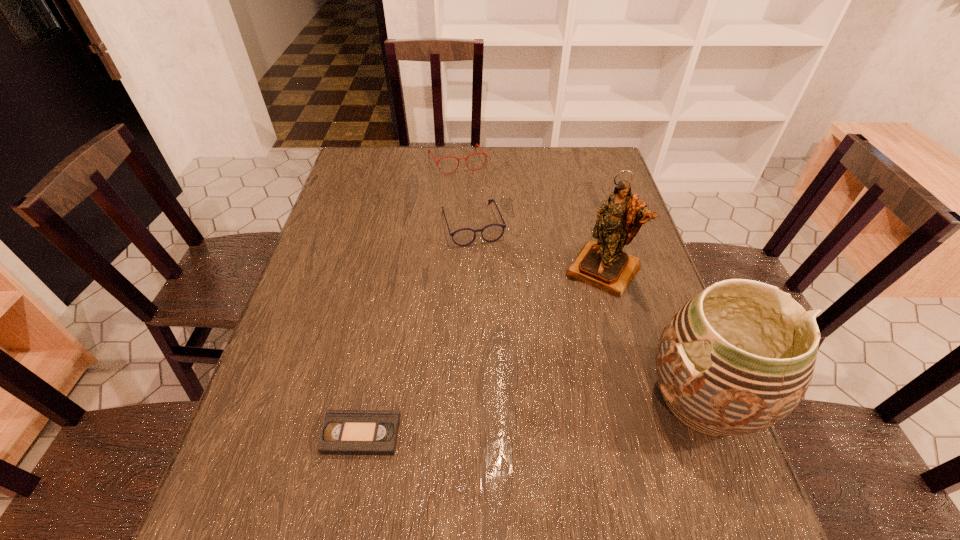
In order to click on the shortest object in this screenshot , I will do `click(344, 432)`.

Find the location of a particular element. The height and width of the screenshot is (540, 960). pottery is located at coordinates (738, 357).

This screenshot has height=540, width=960. Identify the location of figurine. (603, 264).

Locate an element on the screen. the farther spectacles is located at coordinates (429, 151).

Identify the location of the nearer spectacles. Image resolution: width=960 pixels, height=540 pixels. (463, 237).

The image size is (960, 540). Identify the location of vacant space positioned on the back of the shortest object. (377, 349).

Image resolution: width=960 pixels, height=540 pixels. Find the location of `free space located on the back of the pottery`. free space located on the back of the pottery is located at coordinates (674, 325).

Identify the location of vacant space located 0.230m on the front-facing side of the figurine. This screenshot has width=960, height=540. (542, 355).

Identify the location of free space located 0.160m on the front-facing side of the figurine. Image resolution: width=960 pixels, height=540 pixels. (557, 334).

Where is `free point located on the front-facing side of the figurine`? The width and height of the screenshot is (960, 540). free point located on the front-facing side of the figurine is located at coordinates (564, 326).